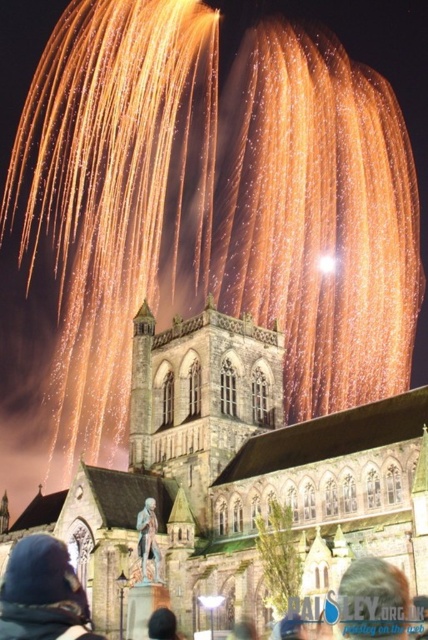
You are a photographer trying to capture the fireworks display in front of the cathedral. You notice two elements in the foreground, the blonde hair at center and the black fabric at lower center. Which of these elements should you focus on if you want to highlight the larger object in your photo?

The black fabric at lower center should be focused on because it occupies more space than the blonde hair at center according to the description.

You are an artist trying to sketch the scene. You notice the blonde hair at center and the black fabric at lower center. Which object should you draw first to ensure proper layering?

The blonde hair at center should be drawn first because it is in front of the black fabric at lower center, allowing you to layer the fabric behind it appropriately.